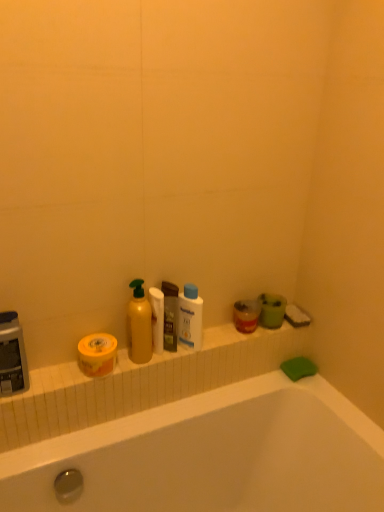
At what (x,y) coordinates should I click in order to perform the action: click on free region on the left part of yellow matte jar at left, which ranks as the second mouthwash in right-to-left order. Please return your answer as a coordinate pair (x, y). The image size is (384, 512). Looking at the image, I should click on (54, 379).